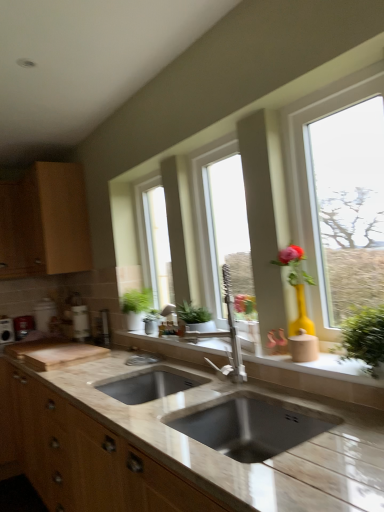
Identify the location of free location above clear glass window at center, marked as the 2th window in a back-to-front arrangement (from a real-world perspective). (210, 142).